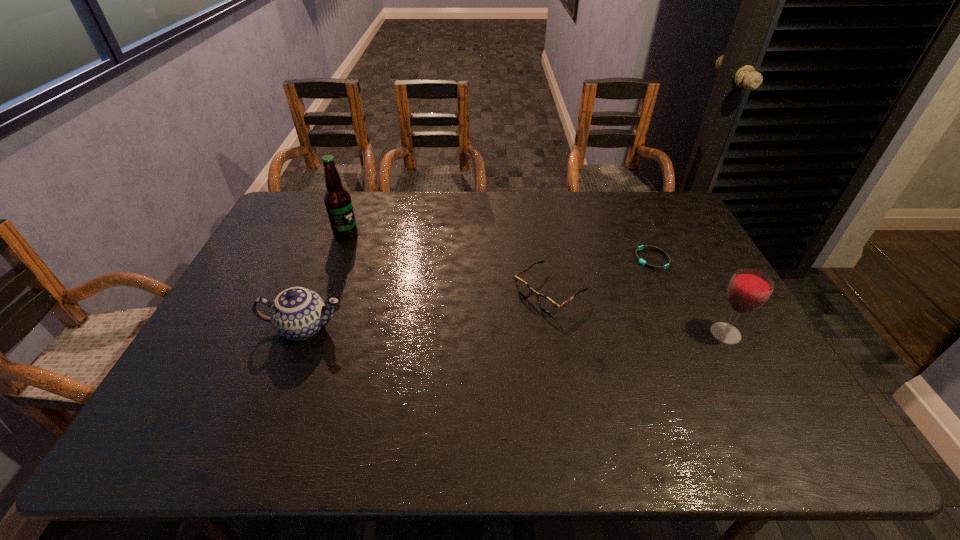
At what (x,y) coordinates should I click in order to perform the action: click on object positioned at the far edge. Please return your answer as a coordinate pair (x, y). Image resolution: width=960 pixels, height=540 pixels. Looking at the image, I should click on (337, 200).

Locate an element on the screen. This screenshot has width=960, height=540. object that is positioned at the left edge is located at coordinates (297, 313).

You are a GUI agent. You are given a task and a screenshot of the screen. Output one action in this format:
    pyautogui.click(x=<x>, y=<y>)
    Task: Click on the wineglass that is at the right edge
    The height and width of the screenshot is (540, 960).
    Given the screenshot: What is the action you would take?
    pyautogui.click(x=749, y=289)

At what (x,y) coordinates should I click in order to perform the action: click on wristband that is at the right edge. Please return your answer as a coordinate pair (x, y). The image size is (960, 540). Looking at the image, I should click on (642, 262).

In the image, there is a desktop. In order to click on vacant area at the far edge in this screenshot , I will do `click(510, 204)`.

Where is `vacant space at the near edge of the desktop`? The width and height of the screenshot is (960, 540). vacant space at the near edge of the desktop is located at coordinates pos(679,385).

Find the location of a particular element. The image size is (960, 540). vacant space at the left edge of the desktop is located at coordinates (265, 332).

Image resolution: width=960 pixels, height=540 pixels. What are the coordinates of `vacant space at the right edge of the desktop` in the screenshot? It's located at (708, 265).

The height and width of the screenshot is (540, 960). I want to click on blank area at the near left corner, so click(x=245, y=374).

This screenshot has width=960, height=540. In order to click on free spot between the wristband and the rightmost object in this screenshot , I will do `click(688, 296)`.